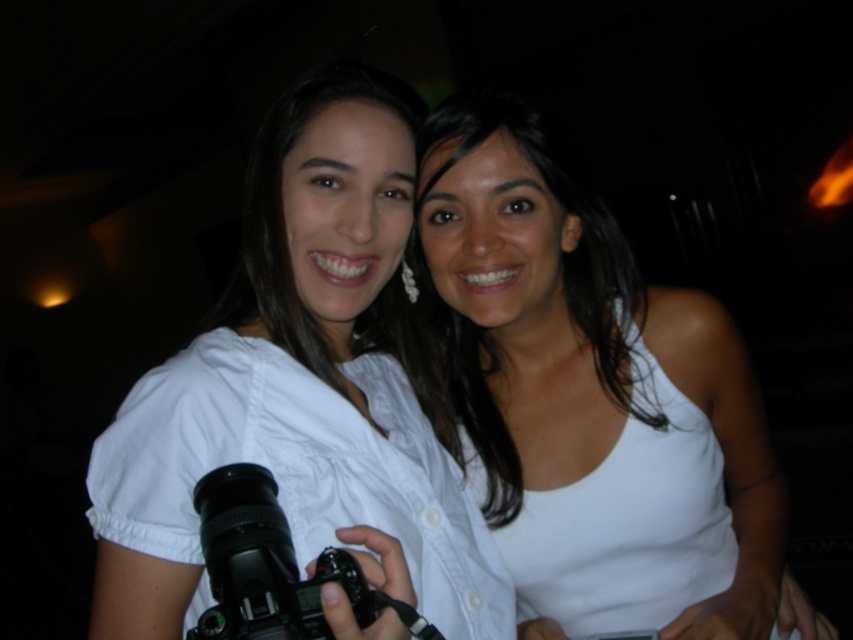
Does white matte tank top at center have a lesser height compared to white matte camera at center?

In fact, white matte tank top at center may be taller than white matte camera at center.

Where is `white matte tank top at center`? The width and height of the screenshot is (853, 640). white matte tank top at center is located at coordinates (593, 396).

Is white matte camera at center positioned before black plastic camera at center?

No, it is not.

Does point (415, 570) lie behind point (236, 493)?

Yes, point (415, 570) is behind point (236, 493).

Find the location of a particular element. white matte camera at center is located at coordinates (302, 388).

Which of these two, white matte tank top at center or black plastic camera at center, stands taller?

white matte tank top at center

Can you confirm if white matte tank top at center is positioned below black plastic camera at center?

Actually, white matte tank top at center is above black plastic camera at center.

Find the location of a particular element. Image resolution: width=853 pixels, height=640 pixels. white matte tank top at center is located at coordinates (593, 396).